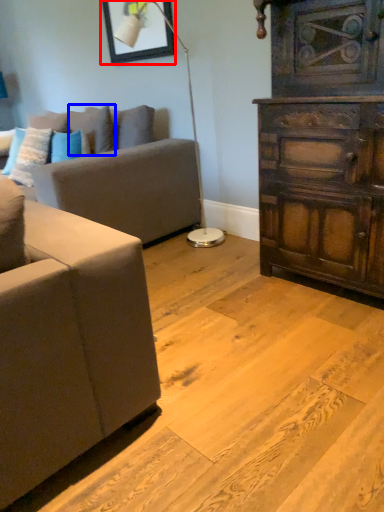
Question: Which of the following is the farthest to the observer, picture frame (highlighted by a red box) or pillow (highlighted by a blue box)?

Choices:
 (A) picture frame
 (B) pillow

Answer: (B)